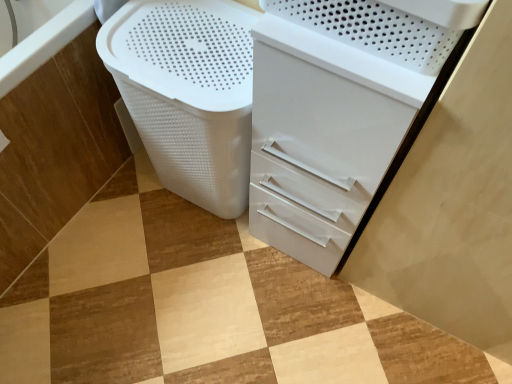
Question: Can you confirm if white glossy file cabinet at center is taller than white plastic laundry basket at lower left?

Choices:
 (A) no
 (B) yes

Answer: (B)

Question: From a real-world perspective, is white glossy file cabinet at center under white plastic laundry basket at lower left?

Choices:
 (A) no
 (B) yes

Answer: (A)

Question: Would you say white glossy file cabinet at center is outside white plastic laundry basket at lower left?

Choices:
 (A) no
 (B) yes

Answer: (B)

Question: Can you confirm if white glossy file cabinet at center is positioned to the right of white plastic laundry basket at lower left?

Choices:
 (A) yes
 (B) no

Answer: (A)

Question: Is white glossy file cabinet at center thinner than white plastic laundry basket at lower left?

Choices:
 (A) yes
 (B) no

Answer: (A)

Question: Can you confirm if white glossy file cabinet at center is shorter than white plastic laundry basket at lower left?

Choices:
 (A) no
 (B) yes

Answer: (A)

Question: Is white glossy file cabinet at center positioned far away from white plastic basket at lower left?

Choices:
 (A) yes
 (B) no

Answer: (B)

Question: Is white glossy file cabinet at center bigger than white plastic basket at lower left?

Choices:
 (A) no
 (B) yes

Answer: (B)

Question: Considering the relative positions of white glossy file cabinet at center and white plastic basket at lower left in the image provided, is white glossy file cabinet at center in front of white plastic basket at lower left?

Choices:
 (A) yes
 (B) no

Answer: (A)

Question: Does white glossy file cabinet at center contain white plastic basket at lower left?

Choices:
 (A) yes
 (B) no

Answer: (B)

Question: Is white glossy file cabinet at center aimed at white plastic basket at lower left?

Choices:
 (A) yes
 (B) no

Answer: (B)

Question: From a real-world perspective, is white glossy file cabinet at center physically below white plastic basket at lower left?

Choices:
 (A) yes
 (B) no

Answer: (B)

Question: Is white plastic basket at lower left closer to camera compared to white glossy file cabinet at center?

Choices:
 (A) no
 (B) yes

Answer: (A)